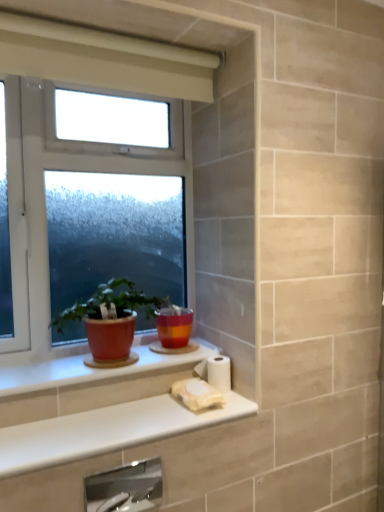
Question: Considering their positions, is white matte toilet paper at lower center, which is the second toilet paper from bottom to top, located in front of or behind matte ceramic pot at window?

Choices:
 (A) behind
 (B) front

Answer: (A)

Question: Is white matte toilet paper at lower center, which is the second toilet paper from bottom to top, to the left or to the right of matte ceramic pot at window in the image?

Choices:
 (A) right
 (B) left

Answer: (A)

Question: Which object is positioned farthest from the matte ceramic window sill at lower left?

Choices:
 (A) white glossy counter top at lower center
 (B) white matte toilet paper at lower center, which is the second toilet paper from bottom to top
 (C) matte ceramic pot at window
 (D) satin nickel faucet at lower center
 (E) white matte toilet paper at lower center, the first toilet paper ordered from the bottom

Answer: (D)

Question: Which object is the closest to the white glossy counter top at lower center?

Choices:
 (A) white matte toilet paper at lower center, the 2th toilet paper in the top-to-bottom sequence
 (B) white plastic window at center
 (C) matte ceramic flowerpot at center
 (D) matte ceramic pot at window
 (E) satin nickel faucet at lower center

Answer: (A)